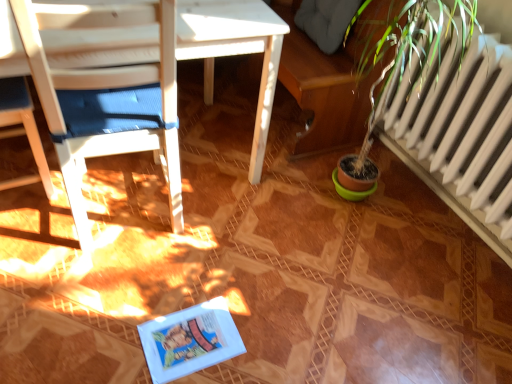
Question: Looking at the image, does white wood chair at left, which ranks as the first chair in left-to-right order, seem bigger or smaller compared to white wood chair at left, positioned as the second chair in left-to-right order?

Choices:
 (A) big
 (B) small

Answer: (B)

Question: Based on their positions, is white wood chair at left, positioned as the 2th chair in right-to-left order, located to the left or right of white wood chair at left, positioned as the second chair in left-to-right order?

Choices:
 (A) left
 (B) right

Answer: (A)

Question: In the image, is white wood chair at left, which ranks as the first chair in left-to-right order, positioned in front of or behind white wood chair at left, positioned as the second chair in left-to-right order?

Choices:
 (A) front
 (B) behind

Answer: (B)

Question: From a real-world perspective, relative to white wood chair at left, which ranks as the first chair in left-to-right order, is white wood chair at left, positioned as the second chair in left-to-right order, vertically above or below?

Choices:
 (A) below
 (B) above

Answer: (B)

Question: In the image, is white wood chair at left, positioned as the second chair in left-to-right order, on the left side or the right side of white wood chair at left, positioned as the 2th chair in right-to-left order?

Choices:
 (A) right
 (B) left

Answer: (A)

Question: From the image's perspective, relative to white wood chair at left, which ranks as the first chair in left-to-right order, is white wood chair at left, acting as the 1th chair starting from the right, above or below?

Choices:
 (A) below
 (B) above

Answer: (A)

Question: Is white wood chair at left, acting as the 1th chair starting from the right, taller or shorter than white wood chair at left, positioned as the 2th chair in right-to-left order?

Choices:
 (A) tall
 (B) short

Answer: (A)